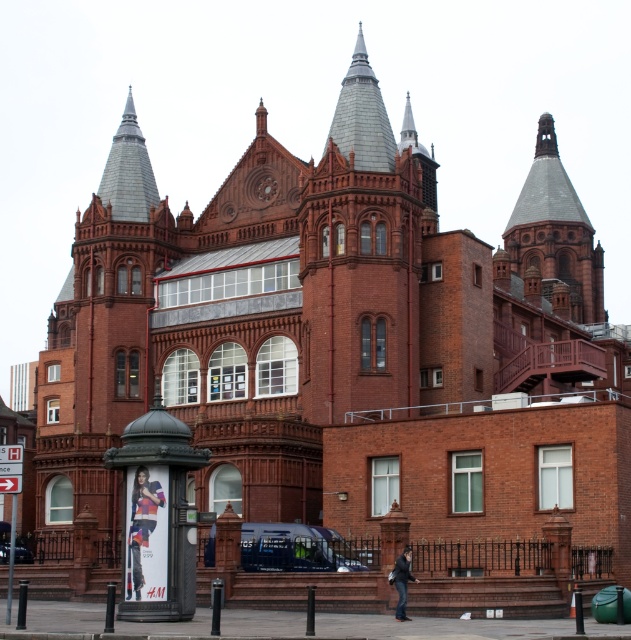
Question: In this image, where is multicolored fabric poster at center located relative to shiny silver spire at upper center?

Choices:
 (A) left
 (B) right

Answer: (A)

Question: Which of these objects is positioned farthest from the shiny silver spire at upper center?

Choices:
 (A) multicolored fabric poster at center
 (B) smooth stone tower at upper center
 (C) dark blue leather jacket at lower center
 (D) shiny metallic spire at upper left

Answer: (B)

Question: Does smooth stone tower at upper center appear over shiny silver spire at upper center?

Choices:
 (A) no
 (B) yes

Answer: (A)

Question: Is shiny silver spire at upper center below shiny metallic spire at upper left?

Choices:
 (A) no
 (B) yes

Answer: (A)

Question: Which point is closer to the camera?

Choices:
 (A) multicolored fabric poster at center
 (B) shiny metallic spire at upper left
 (C) smooth stone tower at upper center
 (D) dark blue leather jacket at lower center

Answer: (A)

Question: Which object is positioned closest to the smooth stone tower at upper center?

Choices:
 (A) dark blue leather jacket at lower center
 (B) shiny metallic spire at upper left
 (C) shiny silver spire at upper center

Answer: (B)